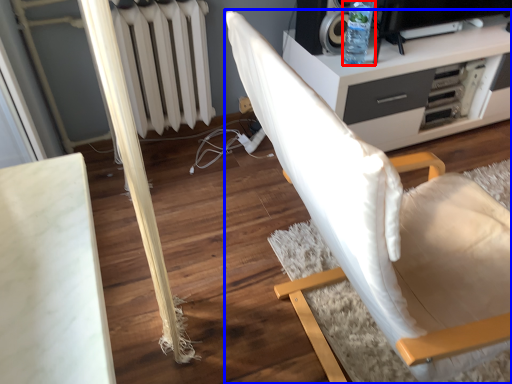
Question: Among these objects, which one is farthest to the camera, bottle (highlighted by a red box) or chair (highlighted by a blue box)?

Choices:
 (A) bottle
 (B) chair

Answer: (A)